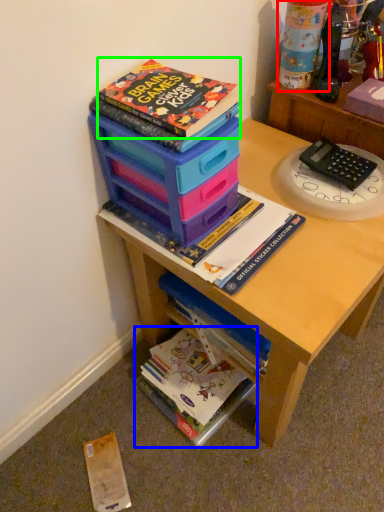
Question: Considering the real-world distances, which object is closest to toy (highlighted by a red box)? book (highlighted by a blue box) or book (highlighted by a green box).

Choices:
 (A) book
 (B) book

Answer: (B)